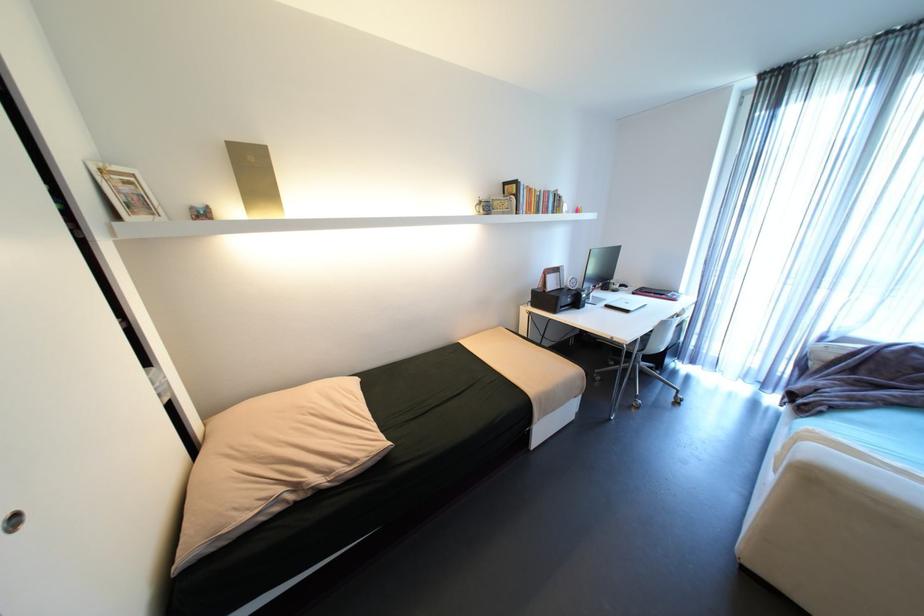
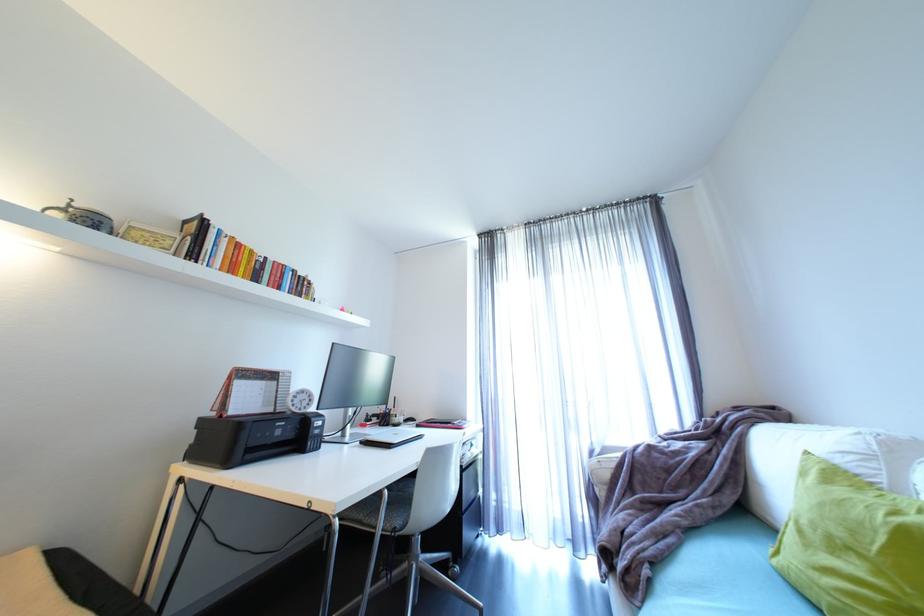
Where in the second image is the point corresponding to pixel 484 203 from the first image?

(69, 206)